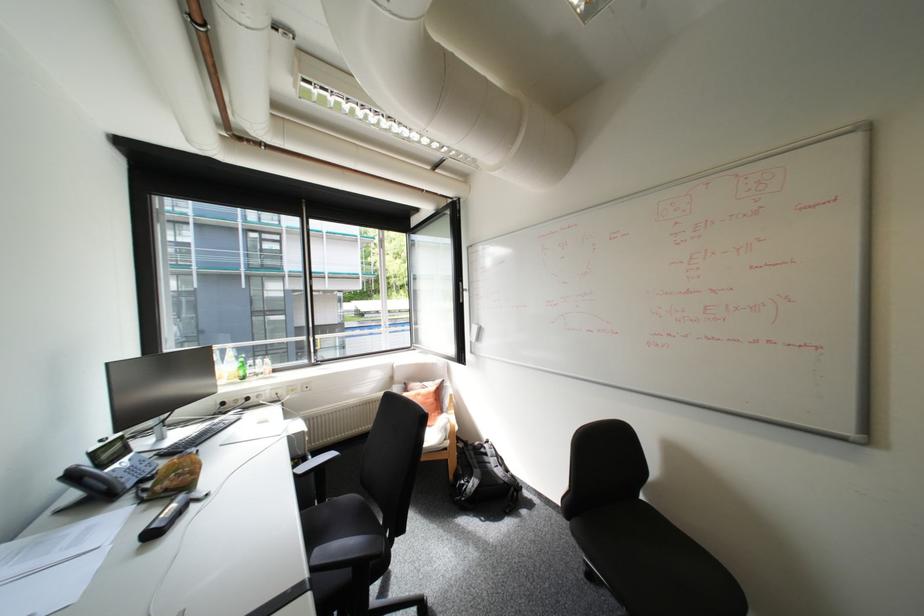
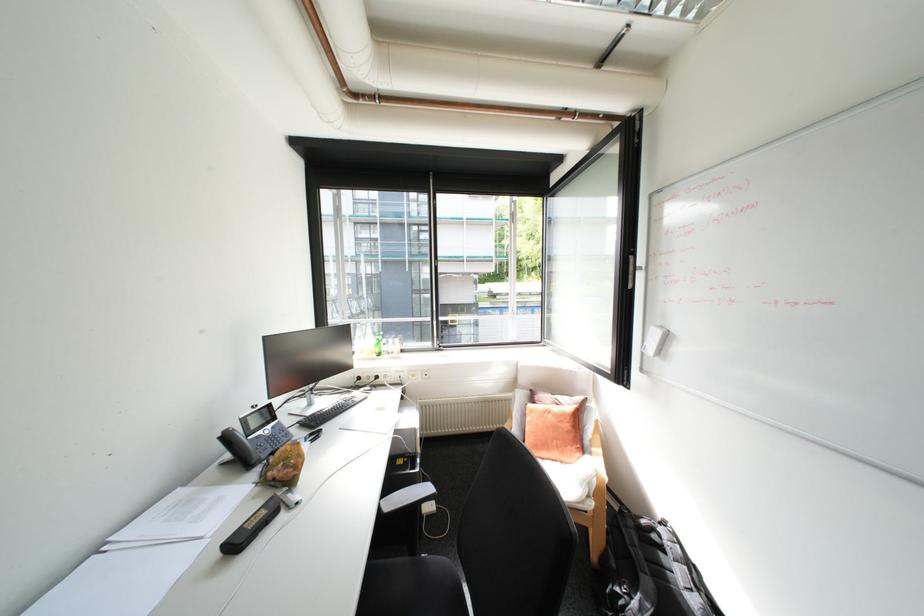
In the second image, find the point that corresponds to pixel 239 379 in the first image.

(379, 354)